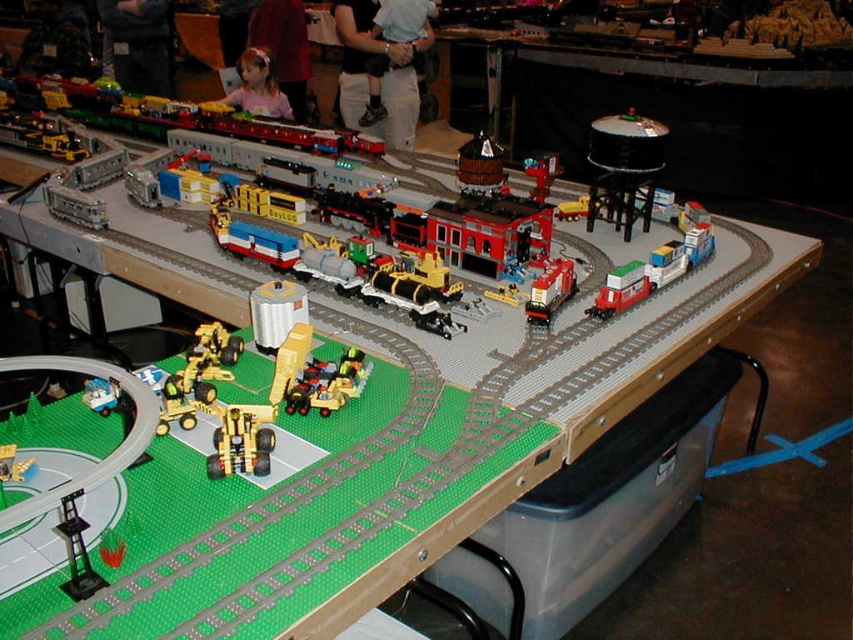
You are a toy collector who wants to place both the shiny red plastic train at center and the metallic red train at center side by side on a shelf. Based on the scene description, which train will require more horizontal space on the shelf?

The shiny red plastic train at center requires more horizontal space because its width surpasses that of the metallic red train at center.

You are a model train enthusiast who wants to place a new toy figure wearing a light blue shirt at center next to the gold metallic construction vehicle at center. Based on the scene description, will the toy figure be taller than the construction vehicle?

The light blue shirt at center is much taller than the gold metallic construction vehicle at center, so yes, the toy figure wearing the light blue shirt at center will be taller than the gold metallic construction vehicle at center.

You are looking at a person dressed in dark blue jeans at center and a light blue shirt at center. Which piece of clothing is on the left side?

The dark blue jeans at center is positioned on the left side of light blue shirt at center.